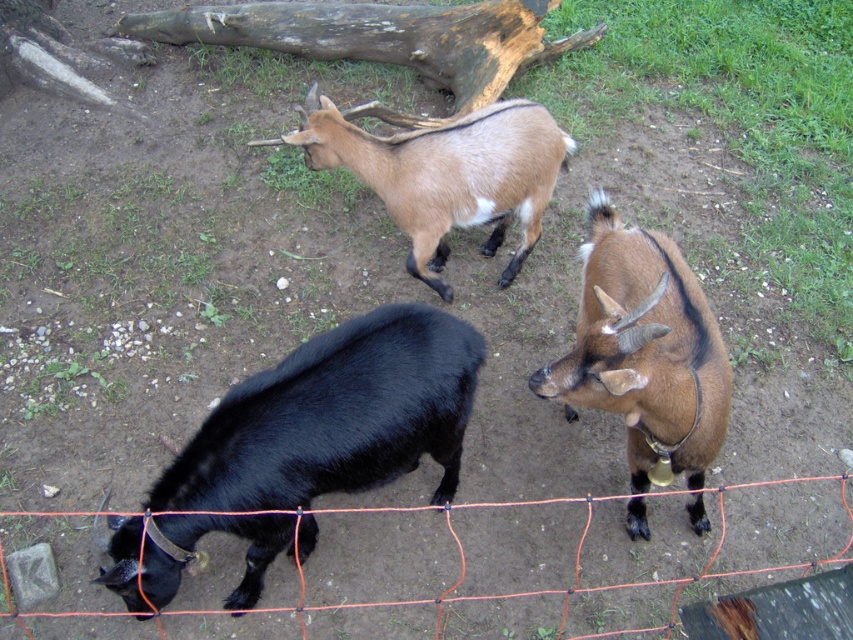
Question: Which of the following is the farthest from the observer?

Choices:
 (A) (426, 326)
 (B) (337, 35)
 (C) (611, 332)
 (D) (454, 177)

Answer: (B)

Question: Which point appears closest to the camera in this image?

Choices:
 (A) (291, 611)
 (B) (337, 330)

Answer: (B)

Question: Estimate the real-world distances between objects in this image. Which object is closer to the brown matte goat at upper center?

Choices:
 (A) orange mesh fence at lower center
 (B) brown weathered log at upper center

Answer: (B)

Question: Is the position of brown weathered log at upper center more distant than that of orange mesh fence at lower center?

Choices:
 (A) no
 (B) yes

Answer: (B)

Question: Can you confirm if black glossy goat at lower left is positioned to the left of brown weathered log at upper center?

Choices:
 (A) yes
 (B) no

Answer: (B)

Question: Does brown weathered log at upper center have a smaller size compared to orange mesh fence at lower center?

Choices:
 (A) no
 (B) yes

Answer: (A)